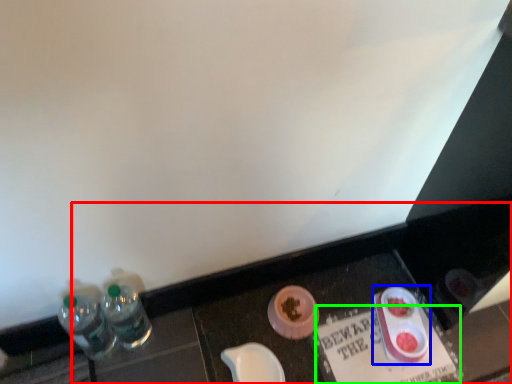
Question: Which is nearer to the vanity (highlighted by a red box)? tableware (highlighted by a blue box) or writing (highlighted by a green box).

Choices:
 (A) tableware
 (B) writing

Answer: (B)